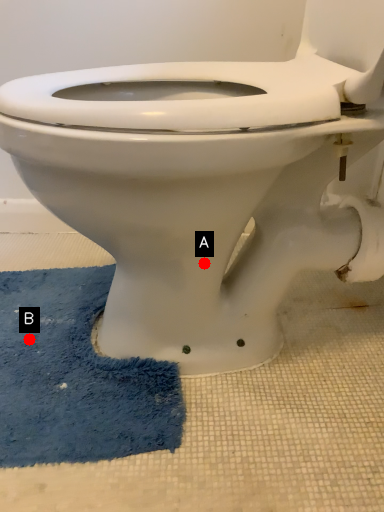
Question: Two points are circled on the image, labeled by A and B beside each circle. Which point appears farthest from the camera in this image?

Choices:
 (A) A is further
 (B) B is further

Answer: (B)